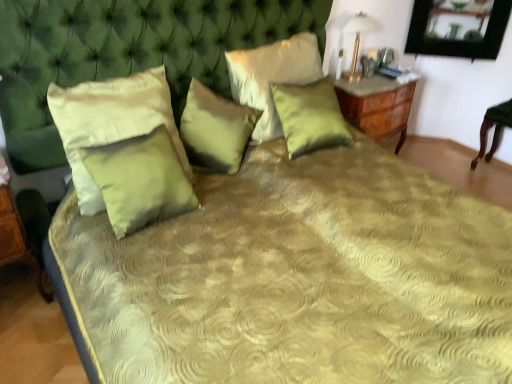
Question: Is matte green pillow at left, the fifth pillow viewed from the right, shorter than satin green pillow at upper center, which is counted as the second pillow, starting from the right?

Choices:
 (A) no
 (B) yes

Answer: (A)

Question: Are matte green pillow at left, the fifth pillow viewed from the right, and satin green pillow at upper center, which is counted as the second pillow, starting from the right, located far from each other?

Choices:
 (A) yes
 (B) no

Answer: (B)

Question: From the image's perspective, is matte green pillow at left, the fifth pillow viewed from the right, above satin green pillow at upper center, which is counted as the second pillow, starting from the right?

Choices:
 (A) yes
 (B) no

Answer: (B)

Question: Is matte green pillow at left, arranged as the 1th pillow when viewed from the left, next to satin green pillow at upper center, placed as the 4th pillow when sorted from left to right, and touching it?

Choices:
 (A) yes
 (B) no

Answer: (B)

Question: Considering the relative sizes of matte green pillow at left, arranged as the 1th pillow when viewed from the left, and satin green pillow at upper center, placed as the 4th pillow when sorted from left to right, in the image provided, is matte green pillow at left, arranged as the 1th pillow when viewed from the left, wider than satin green pillow at upper center, placed as the 4th pillow when sorted from left to right,?

Choices:
 (A) yes
 (B) no

Answer: (B)

Question: Is matte green pillow at left, the fifth pillow viewed from the right, positioned beyond the bounds of satin green pillow at upper center, placed as the 4th pillow when sorted from left to right?

Choices:
 (A) yes
 (B) no

Answer: (A)

Question: Is gold metallic table lamp at upper right further to the viewer compared to satin green pillow at center, the second pillow in the left-to-right sequence?

Choices:
 (A) yes
 (B) no

Answer: (A)

Question: Are gold metallic table lamp at upper right and satin green pillow at center, the fourth pillow viewed from the right, far apart?

Choices:
 (A) no
 (B) yes

Answer: (B)

Question: Does gold metallic table lamp at upper right have a larger size compared to satin green pillow at center, the fourth pillow viewed from the right?

Choices:
 (A) no
 (B) yes

Answer: (A)

Question: From the image's perspective, is gold metallic table lamp at upper right located beneath satin green pillow at center, the fourth pillow viewed from the right?

Choices:
 (A) yes
 (B) no

Answer: (B)

Question: From a real-world perspective, is gold metallic table lamp at upper right positioned over satin green pillow at center, the second pillow in the left-to-right sequence, based on gravity?

Choices:
 (A) yes
 (B) no

Answer: (A)

Question: Can you confirm if gold metallic table lamp at upper right is taller than satin green pillow at center, the second pillow in the left-to-right sequence?

Choices:
 (A) no
 (B) yes

Answer: (A)

Question: Is satin green pillow at upper center, placed as the 4th pillow when sorted from left to right, facing away from gold metallic table lamp at upper right?

Choices:
 (A) yes
 (B) no

Answer: (B)